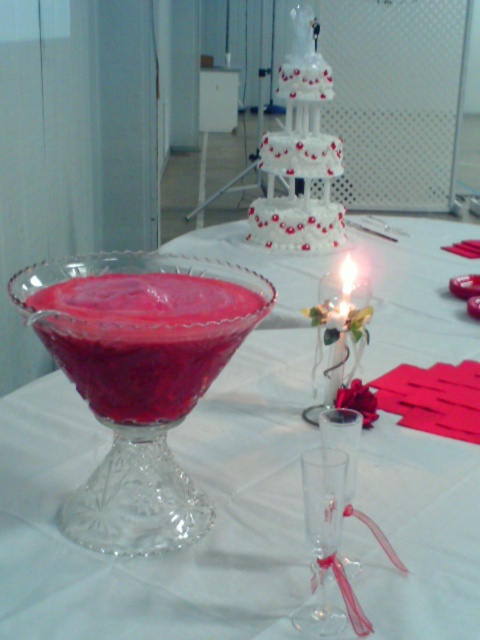
Which is more to the right, transparent crystal martini glass at center or clear glass wine glass at center?

clear glass wine glass at center is more to the right.

Between point (159, 497) and point (324, 506), which one is positioned behind?

The point (159, 497) is more distant.

Where is `transparent crystal martini glass at center`? This screenshot has height=640, width=480. transparent crystal martini glass at center is located at coordinates (140, 378).

Measure the distance from matte white candle at center to transparent glass at center.

matte white candle at center and transparent glass at center are 7.42 inches apart from each other.

Which is more to the right, matte white candle at center or transparent glass at center?

matte white candle at center

You are a GUI agent. You are given a task and a screenshot of the screen. Output one action in this format:
    pyautogui.click(x=<x>, y=<y>)
    Task: Click on the matte white candle at center
    
    Given the screenshot: What is the action you would take?
    pyautogui.click(x=338, y=332)

Is transparent glass punch bowl at center closer to camera compared to transparent glass at center?

Yes, transparent glass punch bowl at center is in front of transparent glass at center.

Between transparent glass punch bowl at center and transparent glass at center, which one appears on the left side from the viewer's perspective?

Positioned to the left is transparent glass at center.

Where is `transparent glass punch bowl at center`? This screenshot has width=480, height=640. transparent glass punch bowl at center is located at coordinates (189, 474).